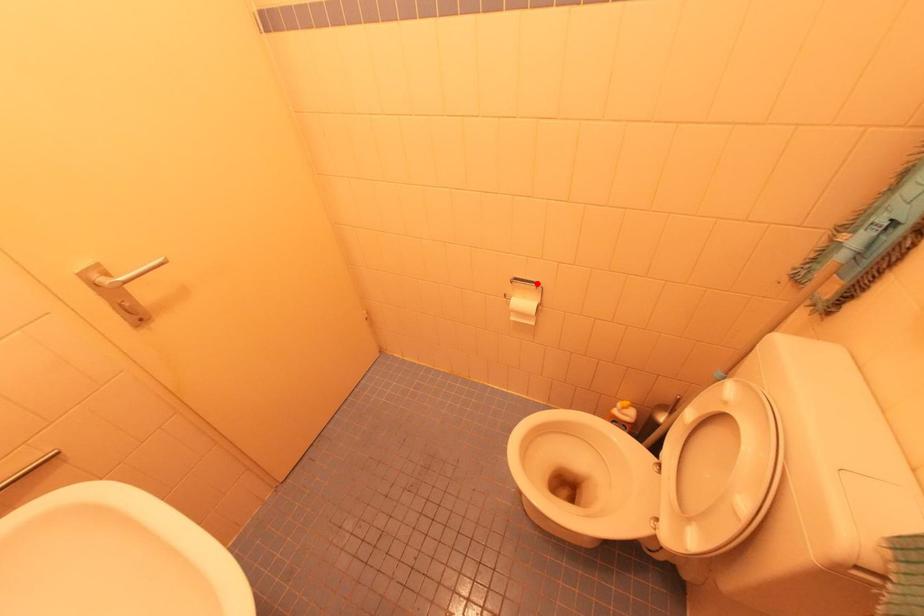
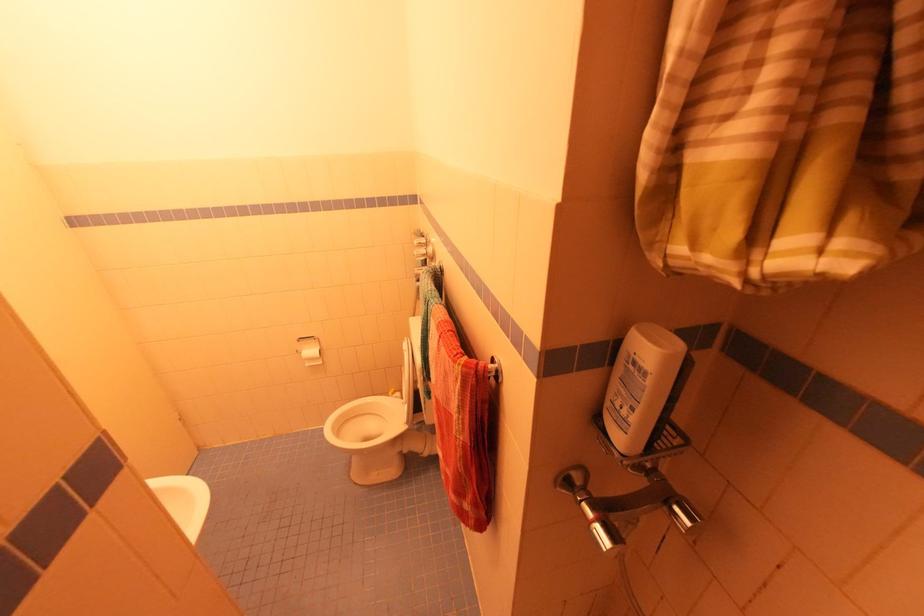
Question: I am providing you with two images of the same scene from different viewpoints. In image1, a red point is highlighted. Considering the same 3D point in image2, which of the following is correct?

Choices:
 (A) It is closer
 (B) It is farther

Answer: (A)